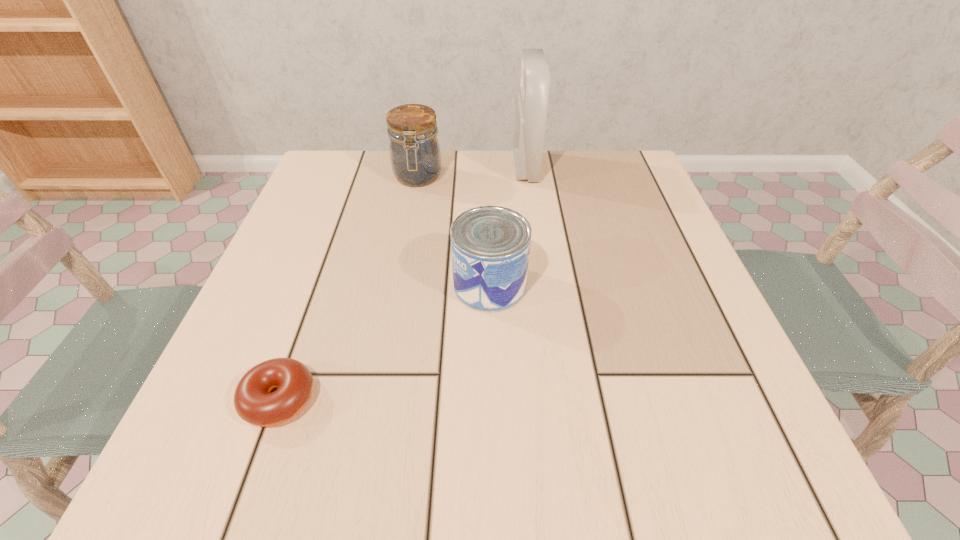
I want to click on the first-aid kit, so click(531, 102).

I want to click on the tallest object, so click(531, 102).

This screenshot has width=960, height=540. Identify the location of jar. [415, 156].

What are the coordinates of `the second tallest object` in the screenshot? It's located at (415, 156).

The width and height of the screenshot is (960, 540). Find the location of `the second shortest object`. the second shortest object is located at coordinates (490, 245).

Find the location of a particular element. the third object from left to right is located at coordinates (490, 245).

Where is `the shortest object`? the shortest object is located at coordinates (254, 401).

Locate an element on the screen. The width and height of the screenshot is (960, 540). doughnut is located at coordinates (254, 401).

The height and width of the screenshot is (540, 960). Find the location of `free space located 0.100m on the front-facing side of the rightmost object`. free space located 0.100m on the front-facing side of the rightmost object is located at coordinates [473, 167].

This screenshot has width=960, height=540. In order to click on vacant space located on the front-facing side of the rightmost object in this screenshot , I will do `click(461, 167)`.